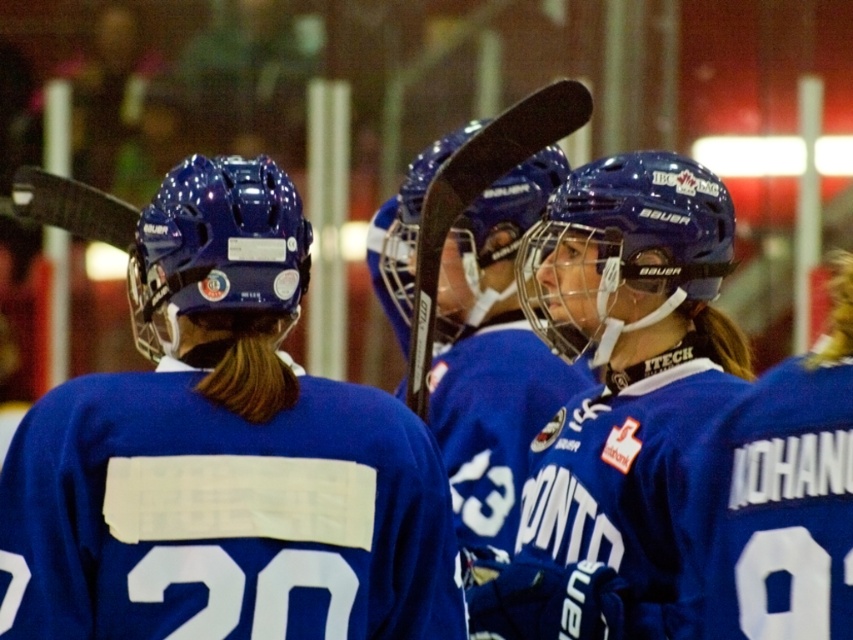
In the scene shown: Between matte blue jersey at center and blue jersey at center, which one has less height?

blue jersey at center is shorter.

Which is more to the right, matte blue jersey at center or blue jersey at center?

From the viewer's perspective, blue jersey at center appears more on the right side.

Where is `matte blue jersey at center`? The image size is (853, 640). matte blue jersey at center is located at coordinates (223, 456).

The image size is (853, 640). In order to click on matte blue jersey at center in this screenshot , I will do `click(223, 456)`.

Is blue jersey at center above black matte hockey stick at center?

Actually, blue jersey at center is below black matte hockey stick at center.

Is point (805, 584) positioned behind point (489, 179)?

No, (805, 584) is closer to viewer.

Image resolution: width=853 pixels, height=640 pixels. What are the coordinates of `blue jersey at center` in the screenshot? It's located at (780, 497).

This screenshot has width=853, height=640. In order to click on blue jersey at center in this screenshot , I will do `click(780, 497)`.

Is matte blue jersey at center shorter than black matte hockey stick at center?

In fact, matte blue jersey at center may be taller than black matte hockey stick at center.

Between point (410, 589) and point (473, 170), which one is positioned in front?

Point (410, 589) is in front.

What are the coordinates of `matte blue jersey at center` in the screenshot? It's located at (223, 456).